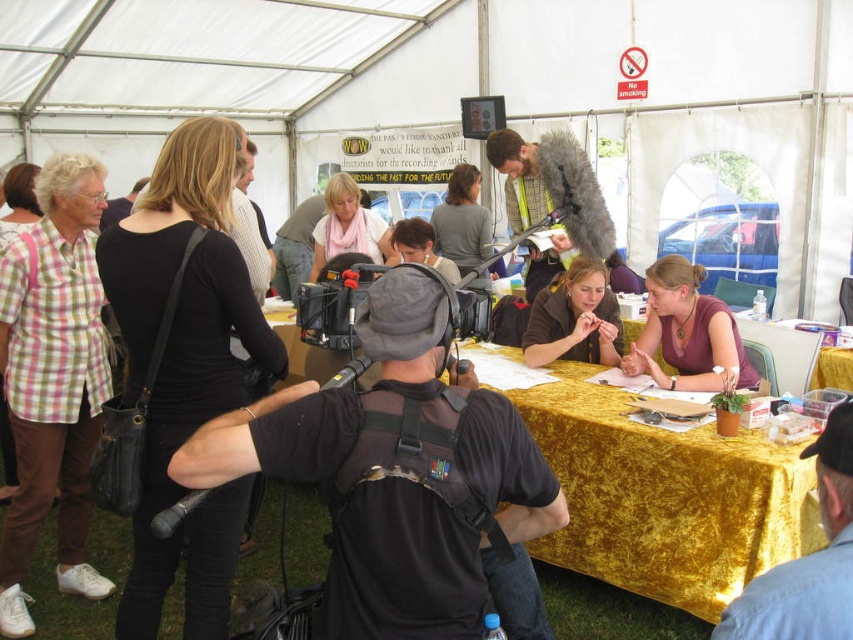
Question: Is black leather bag at upper left to the left of blue denim shirt at lower right from the viewer's perspective?

Choices:
 (A) no
 (B) yes

Answer: (B)

Question: Which of the following is the closest to the observer?

Choices:
 (A) matte brown jacket at center
 (B) pink scarf at center
 (C) black leather bag at upper left
 (D) purple fabric at center

Answer: (C)

Question: Observing the image, what is the correct spatial positioning of black leather bag at upper left in reference to matte brown jacket at center?

Choices:
 (A) left
 (B) right

Answer: (A)

Question: Estimate the real-world distances between objects in this image. Which object is closer to the pink scarf at center?

Choices:
 (A) matte brown jacket at center
 (B) blue denim shirt at lower right
 (C) matte gray microphone at center

Answer: (A)

Question: Can you confirm if black leather bag at upper left is bigger than purple fabric at center?

Choices:
 (A) yes
 (B) no

Answer: (A)

Question: Based on their relative distances, which object is farther from the purple fabric at center?

Choices:
 (A) pink scarf at center
 (B) matte brown jacket at center

Answer: (A)